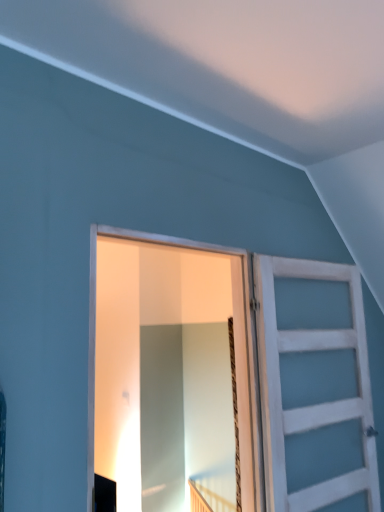
Where is `white wooden barn door at center, the 2th barn door viewed from the right`? This screenshot has height=512, width=384. white wooden barn door at center, the 2th barn door viewed from the right is located at coordinates (162, 323).

The image size is (384, 512). Describe the element at coordinates (162, 323) in the screenshot. I see `white wooden barn door at center, the 2th barn door viewed from the right` at that location.

The image size is (384, 512). What do you see at coordinates (314, 387) in the screenshot?
I see `white wooden barn door at right, the 2th barn door positioned from the left` at bounding box center [314, 387].

Measure the distance between white wooden barn door at right, the 2th barn door positioned from the left, and camera.

1.87 meters.

Identify the location of white wooden barn door at right, placed as the first barn door when sorted from right to left. (314, 387).

Where is `white wooden barn door at center, the 1th barn door viewed from the left`? white wooden barn door at center, the 1th barn door viewed from the left is located at coordinates (162, 323).

Between white wooden barn door at center, the 2th barn door viewed from the right, and white wooden barn door at right, the 2th barn door positioned from the left, which one appears on the right side from the viewer's perspective?

Positioned to the right is white wooden barn door at right, the 2th barn door positioned from the left.

Which object is closer to the camera, white wooden barn door at center, the 1th barn door viewed from the left, or white wooden barn door at right, the 2th barn door positioned from the left?

white wooden barn door at center, the 1th barn door viewed from the left.

Is point (133, 259) positioned after point (307, 441)?

Yes, point (133, 259) is behind point (307, 441).

From the image's perspective, is white wooden barn door at center, the 2th barn door viewed from the right, below white wooden barn door at right, placed as the first barn door when sorted from right to left?

No, from the image's perspective, white wooden barn door at center, the 2th barn door viewed from the right, is not below white wooden barn door at right, placed as the first barn door when sorted from right to left.

From a real-world perspective, is white wooden barn door at center, the 1th barn door viewed from the left, located beneath white wooden barn door at right, the 2th barn door positioned from the left?

No, from a real-world perspective, white wooden barn door at center, the 1th barn door viewed from the left, is not beneath white wooden barn door at right, the 2th barn door positioned from the left.

Considering the sizes of white wooden barn door at center, the 1th barn door viewed from the left, and white wooden barn door at right, the 2th barn door positioned from the left, in the image, is white wooden barn door at center, the 1th barn door viewed from the left, wider or thinner than white wooden barn door at right, the 2th barn door positioned from the left,?

In the image, white wooden barn door at center, the 1th barn door viewed from the left, appears to be more narrow than white wooden barn door at right, the 2th barn door positioned from the left.

Between white wooden barn door at center, the 2th barn door viewed from the right, and white wooden barn door at right, placed as the first barn door when sorted from right to left, which one has less height?

white wooden barn door at center, the 2th barn door viewed from the right.

Who is smaller, white wooden barn door at center, the 2th barn door viewed from the right, or white wooden barn door at right, the 2th barn door positioned from the left?

Smaller between the two is white wooden barn door at center, the 2th barn door viewed from the right.

Looking at this image, which is correct: white wooden barn door at center, the 1th barn door viewed from the left, is inside white wooden barn door at right, the 2th barn door positioned from the left, or outside of it?

white wooden barn door at center, the 1th barn door viewed from the left, is outside white wooden barn door at right, the 2th barn door positioned from the left.

Is white wooden barn door at center, the 2th barn door viewed from the right, not close to white wooden barn door at right, the 2th barn door positioned from the left?

They are positioned close to each other.

Is white wooden barn door at center, the 1th barn door viewed from the left, looking in the opposite direction of white wooden barn door at right, placed as the first barn door when sorted from right to left?

No.

How many degrees apart are the facing directions of white wooden barn door at center, the 2th barn door viewed from the right, and white wooden barn door at right, placed as the first barn door when sorted from right to left?

6.74 degrees.

This screenshot has width=384, height=512. I want to click on barn door below the white wooden barn door at center, the 1th barn door viewed from the left (from a real-world perspective), so click(x=314, y=387).

Considering the positions of objects white wooden barn door at right, the 2th barn door positioned from the left, and white wooden barn door at center, the 2th barn door viewed from the right, in the image provided, who is more to the left, white wooden barn door at right, the 2th barn door positioned from the left, or white wooden barn door at center, the 2th barn door viewed from the right,?

white wooden barn door at center, the 2th barn door viewed from the right, is more to the left.

Is the position of white wooden barn door at right, the 2th barn door positioned from the left, more distant than that of white wooden barn door at center, the 1th barn door viewed from the left?

Yes, it is.

Considering the points (348, 304) and (138, 390), which point is behind, point (348, 304) or point (138, 390)?

The point (138, 390) is farther from the camera.

From the image's perspective, would you say white wooden barn door at right, the 2th barn door positioned from the left, is positioned over white wooden barn door at center, the 1th barn door viewed from the left?

Actually, white wooden barn door at right, the 2th barn door positioned from the left, appears below white wooden barn door at center, the 1th barn door viewed from the left, in the image.

From a real-world perspective, is white wooden barn door at right, placed as the first barn door when sorted from right to left, positioned under white wooden barn door at center, the 2th barn door viewed from the right, based on gravity?

Yes.

Considering the relative sizes of white wooden barn door at right, the 2th barn door positioned from the left, and white wooden barn door at center, the 2th barn door viewed from the right, in the image provided, is white wooden barn door at right, the 2th barn door positioned from the left, wider than white wooden barn door at center, the 2th barn door viewed from the right,?

Yes, white wooden barn door at right, the 2th barn door positioned from the left, is wider than white wooden barn door at center, the 2th barn door viewed from the right.

Considering the sizes of objects white wooden barn door at right, placed as the first barn door when sorted from right to left, and white wooden barn door at center, the 1th barn door viewed from the left, in the image provided, who is shorter, white wooden barn door at right, placed as the first barn door when sorted from right to left, or white wooden barn door at center, the 1th barn door viewed from the left,?

Standing shorter between the two is white wooden barn door at center, the 1th barn door viewed from the left.

Is white wooden barn door at right, placed as the first barn door when sorted from right to left, bigger than white wooden barn door at center, the 2th barn door viewed from the right?

Correct, white wooden barn door at right, placed as the first barn door when sorted from right to left, is larger in size than white wooden barn door at center, the 2th barn door viewed from the right.

Would you say white wooden barn door at right, placed as the first barn door when sorted from right to left, is inside or outside white wooden barn door at center, the 2th barn door viewed from the right?

The correct answer is: outside.

Based on the photo, is white wooden barn door at right, placed as the first barn door when sorted from right to left, facing away from white wooden barn door at center, the 1th barn door viewed from the left?

No, white wooden barn door at right, placed as the first barn door when sorted from right to left, is not facing the opposite direction of white wooden barn door at center, the 1th barn door viewed from the left.

What's the angular difference between white wooden barn door at right, the 2th barn door positioned from the left, and white wooden barn door at center, the 1th barn door viewed from the left,'s facing directions?

The facing directions of white wooden barn door at right, the 2th barn door positioned from the left, and white wooden barn door at center, the 1th barn door viewed from the left, are 6.74 degrees apart.

What are the coordinates of `barn door lying on the left of white wooden barn door at right, placed as the first barn door when sorted from right to left` in the screenshot? It's located at (162, 323).

You are a GUI agent. You are given a task and a screenshot of the screen. Output one action in this format:
    pyautogui.click(x=<x>, y=<y>)
    Task: Click on the barn door that appears below the white wooden barn door at center, the 2th barn door viewed from the right (from a real-world perspective)
    The height and width of the screenshot is (512, 384).
    Given the screenshot: What is the action you would take?
    pyautogui.click(x=314, y=387)

Find the location of a particular element. The width and height of the screenshot is (384, 512). barn door above the white wooden barn door at right, placed as the first barn door when sorted from right to left (from the image's perspective) is located at coordinates (162, 323).